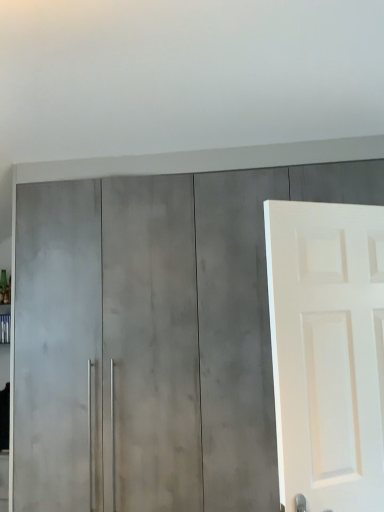
Question: Does point (360, 508) appear closer or farther from the camera than point (119, 236)?

Choices:
 (A) farther
 (B) closer

Answer: (B)

Question: Is white matte door at right in front of or behind satin gray cabinet at center in the image?

Choices:
 (A) front
 (B) behind

Answer: (A)

Question: Which is correct: white matte door at right is inside satin gray cabinet at center, or outside of it?

Choices:
 (A) outside
 (B) inside

Answer: (A)

Question: Is point (56, 422) positioned closer to the camera than point (297, 321)?

Choices:
 (A) farther
 (B) closer

Answer: (A)

Question: Choose the correct answer: Is satin gray cabinet at center inside white matte door at right or outside it?

Choices:
 (A) inside
 (B) outside

Answer: (B)

Question: Based on their sizes in the image, would you say satin gray cabinet at center is bigger or smaller than white matte door at right?

Choices:
 (A) big
 (B) small

Answer: (A)

Question: Considering their positions, is satin gray cabinet at center located in front of or behind white matte door at right?

Choices:
 (A) behind
 (B) front

Answer: (A)